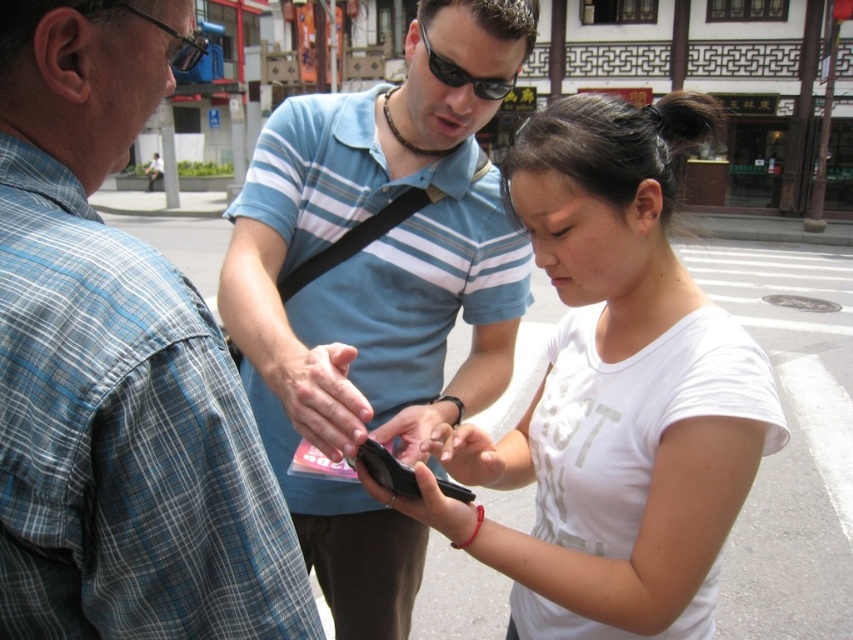
Between blue striped shirt at center and sunglasses at center, which one has more height?

With more height is blue striped shirt at center.

Is point (381, 621) farther from viewer compared to point (480, 77)?

Yes, point (381, 621) is behind point (480, 77).

You are a GUI agent. You are given a task and a screenshot of the screen. Output one action in this format:
    pyautogui.click(x=<x>, y=<y>)
    Task: Click on the blue striped shirt at center
    The height and width of the screenshot is (640, 853).
    Given the screenshot: What is the action you would take?
    pyautogui.click(x=376, y=292)

Looking at this image, is white matte shirt at center positioned at the back of sunglasses at center?

No, it is in front of sunglasses at center.

Can you confirm if white matte shirt at center is positioned below sunglasses at center?

Yes, white matte shirt at center is below sunglasses at center.

The width and height of the screenshot is (853, 640). What do you see at coordinates (614, 394) in the screenshot?
I see `white matte shirt at center` at bounding box center [614, 394].

Where is `white matte shirt at center`? This screenshot has width=853, height=640. white matte shirt at center is located at coordinates (614, 394).

Between white matte shirt at center and black matte smartphone at center, which one is positioned lower?

black matte smartphone at center is lower down.

Is white matte shirt at center above black matte smartphone at center?

Yes, white matte shirt at center is above black matte smartphone at center.

Locate an element on the screen. The height and width of the screenshot is (640, 853). white matte shirt at center is located at coordinates (614, 394).

Find the location of `white matte shirt at center`. white matte shirt at center is located at coordinates (614, 394).